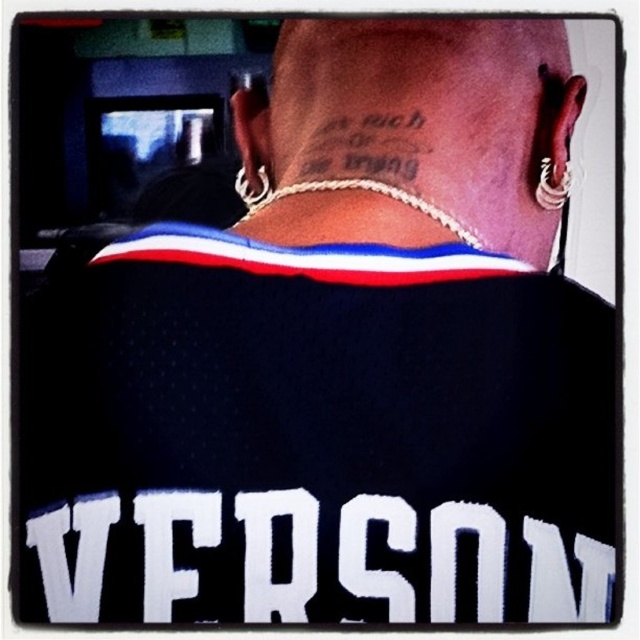
From the picture: You are a tattoo artist assessing the spacing between two tattoos on the back of a client. The tattoos are the black skin tattoo at center and the black ink tattoo at center. The client wants to know if there is enough space between them for a new small flower design. Can you determine if there is sufficient space?

The black skin tattoo at center and the black ink tattoo at center are 2.26 inches apart. Since the desired flower design is small, this distance should be sufficient to accommodate it between them.

Based on the photo, you are a tattoo artist reviewing a client photo. The client has a black skin tattoo at center and a black ink tattoo at center. Which tattoo is bigger?

The black skin tattoo at center is larger in size compared to the black ink tattoo at center.

You are taking a photo of the tattoo on the back of the neck and need to focus on the text. Which point, point (218, 612) or point (333, 179), is closer to the camera and should be in focus?

Point (218, 612) is further to the camera than point (333, 179), so the point closer to the camera is point (333, 179) and should be in focus.